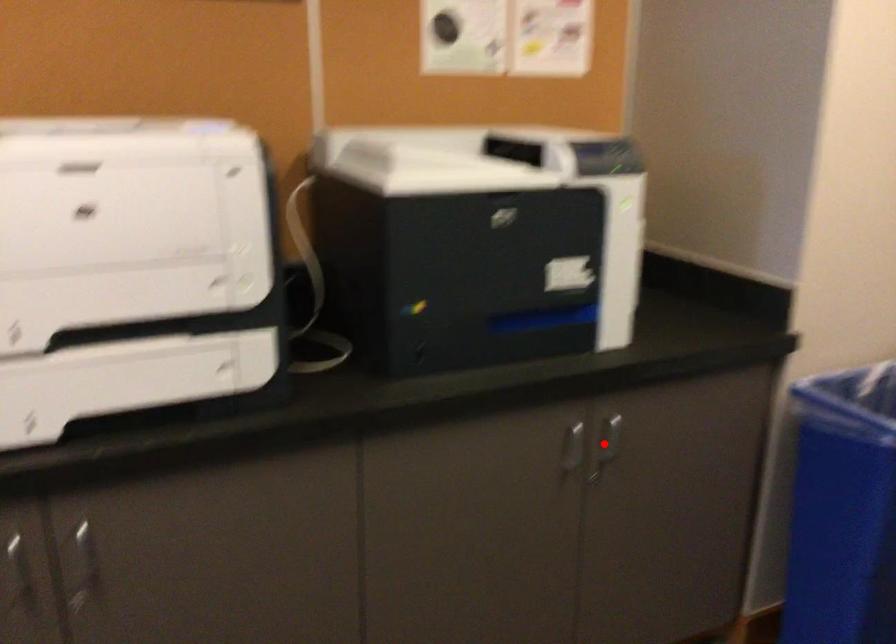
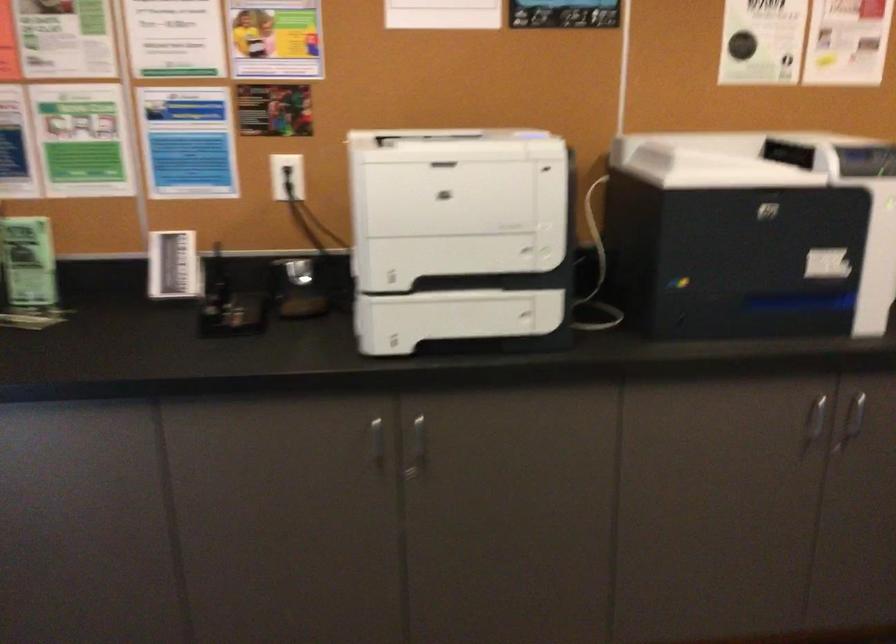
Find the pixel in the second image that matches the highlighted location in the first image.

(853, 418)